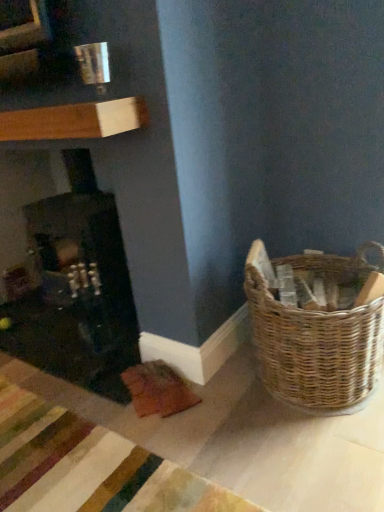
Where is `matte black fireplace at left`? This screenshot has height=512, width=384. matte black fireplace at left is located at coordinates (70, 288).

What do you see at coordinates (70, 288) in the screenshot? The width and height of the screenshot is (384, 512). I see `matte black fireplace at left` at bounding box center [70, 288].

From the picture: What is the approximate width of matte black fireplace at left?

The width of matte black fireplace at left is 23.09 inches.

Measure the distance between woven brown basket at lower right and camera.

A distance of 1.40 meters exists between woven brown basket at lower right and camera.

The width and height of the screenshot is (384, 512). Describe the element at coordinates (316, 333) in the screenshot. I see `woven brown basket at lower right` at that location.

Find the location of a particular element. This screenshot has height=512, width=384. woven brown basket at lower right is located at coordinates (316, 333).

Measure the distance between point (307, 381) and camera.

Point (307, 381) and camera are 5.11 feet apart.

At what (x,y) coordinates should I click in order to perform the action: click on matte black fireplace at left. Please return your answer as a coordinate pair (x, y). This screenshot has width=384, height=512. Looking at the image, I should click on (70, 288).

Looking at this image, which is more to the right, woven brown basket at lower right or matte black fireplace at left?

woven brown basket at lower right.

Is woven brown basket at lower right positioned before matte black fireplace at left?

Yes.

Is point (312, 374) in front of point (122, 382)?

Yes, it is in front of point (122, 382).

From the image's perspective, between woven brown basket at lower right and matte black fireplace at left, who is located below?

woven brown basket at lower right, from the image's perspective.

Looking at this image, from a real-world perspective, which is physically above, woven brown basket at lower right or matte black fireplace at left?

matte black fireplace at left, from a real-world perspective.

Is woven brown basket at lower right wider or thinner than matte black fireplace at left?

In the image, woven brown basket at lower right appears to be more narrow than matte black fireplace at left.

Which of these two, woven brown basket at lower right or matte black fireplace at left, stands shorter?

Standing shorter between the two is woven brown basket at lower right.

Who is smaller, woven brown basket at lower right or matte black fireplace at left?

woven brown basket at lower right is smaller.

Would you say woven brown basket at lower right is outside matte black fireplace at left?

Yes, woven brown basket at lower right is not within matte black fireplace at left.

Is woven brown basket at lower right next to matte black fireplace at left and touching it?

No, woven brown basket at lower right is not making contact with matte black fireplace at left.

Is woven brown basket at lower right oriented towards matte black fireplace at left?

No, woven brown basket at lower right is not facing towards matte black fireplace at left.

What's the angular difference between woven brown basket at lower right and matte black fireplace at left's facing directions?

They differ by 0.329 degrees in their facing directions.

Find the location of a particular element. This screenshot has width=384, height=512. picnic basket that is below the matte black fireplace at left (from the image's perspective) is located at coordinates (316, 333).

Can you confirm if matte black fireplace at left is positioned to the right of woven brown basket at lower right?

No, matte black fireplace at left is not to the right of woven brown basket at lower right.

Does matte black fireplace at left come in front of woven brown basket at lower right?

That is False.

Considering the points (104, 199) and (265, 318), which point is in front, point (104, 199) or point (265, 318)?

The point (265, 318) is closer to the camera.

From the image's perspective, would you say matte black fireplace at left is positioned over woven brown basket at lower right?

Yes.

From a real-world perspective, between matte black fireplace at left and woven brown basket at lower right, who is vertically higher?

matte black fireplace at left.

Is matte black fireplace at left wider than woven brown basket at lower right?

Yes, matte black fireplace at left is wider than woven brown basket at lower right.

Is matte black fireplace at left taller than woven brown basket at lower right?

Indeed, matte black fireplace at left has a greater height compared to woven brown basket at lower right.

Looking at the image, does matte black fireplace at left seem bigger or smaller compared to woven brown basket at lower right?

Considering their sizes, matte black fireplace at left takes up more space than woven brown basket at lower right.

Is matte black fireplace at left situated inside woven brown basket at lower right or outside?

matte black fireplace at left cannot be found inside woven brown basket at lower right.

Are matte black fireplace at left and woven brown basket at lower right located far from each other?

That's not correct — matte black fireplace at left is a little close to woven brown basket at lower right.

Consider the image. Is matte black fireplace at left aimed at woven brown basket at lower right?

No, matte black fireplace at left is not facing towards woven brown basket at lower right.

I want to click on picnic basket below the matte black fireplace at left (from a real-world perspective), so click(316, 333).

You are a GUI agent. You are given a task and a screenshot of the screen. Output one action in this format:
    pyautogui.click(x=<x>, y=<y>)
    Task: Click on the picnic basket on the right of matte black fireplace at left
    
    Given the screenshot: What is the action you would take?
    pyautogui.click(x=316, y=333)

I want to click on picnic basket located in front of the matte black fireplace at left, so [316, 333].